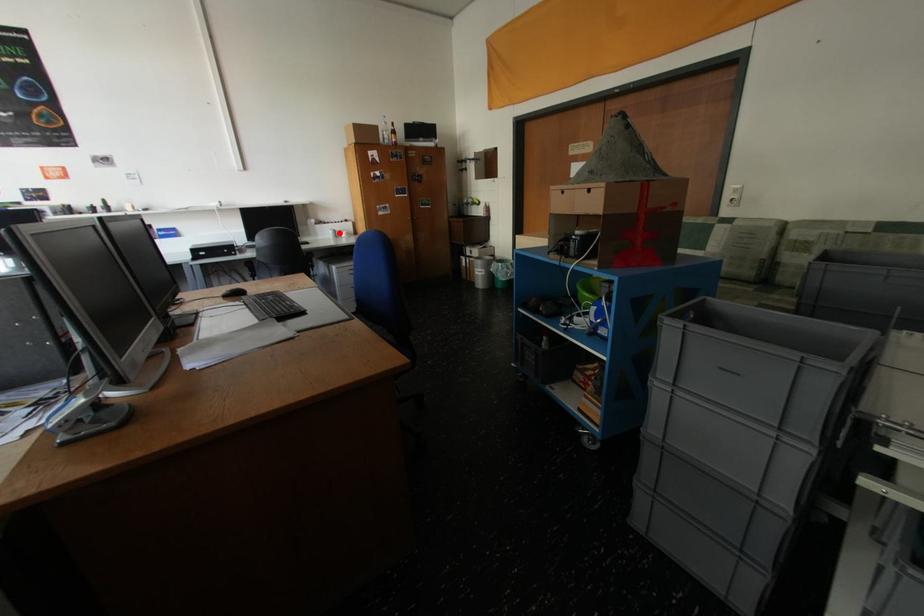
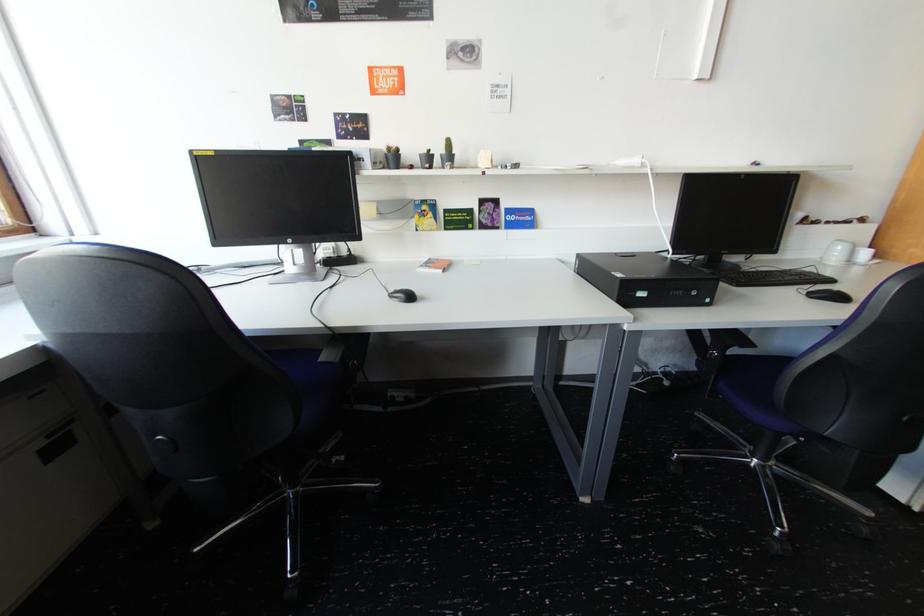
Question: I am providing you with two images of the same scene from different viewpoints. A red point is shown in image1. For the corresponding object point in image2, is it positioned nearer or farther from the camera?

Choices:
 (A) Nearer
 (B) Farther

Answer: (B)